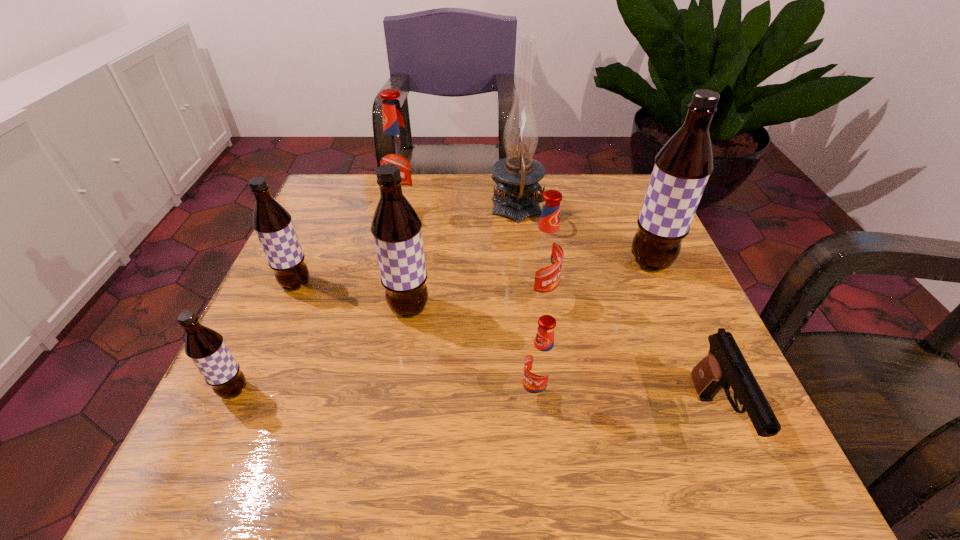
The height and width of the screenshot is (540, 960). Identify the location of the shortest object. (724, 366).

Where is `black pistol`? The width and height of the screenshot is (960, 540). black pistol is located at coordinates (724, 366).

Find the location of a particular element. This screenshot has width=960, height=540. vacant space situated 0.240m on the front of the oil lamp is located at coordinates (527, 309).

Identify the location of free space located 0.360m on the front of the biggest brown root beer. (729, 446).

The height and width of the screenshot is (540, 960). Identify the location of vacant space positioned on the front of the biggest red root beer. (397, 255).

The width and height of the screenshot is (960, 540). I want to click on vacant region located 0.290m on the back of the third brown root beer from left to right, so click(x=424, y=210).

Locate an element on the screen. This screenshot has width=960, height=540. vacant space located on the back of the third biggest brown root beer is located at coordinates (343, 177).

Where is `vacant space located 0.250m on the front of the second smallest red root beer`? vacant space located 0.250m on the front of the second smallest red root beer is located at coordinates (558, 433).

Identify the location of vacant space located 0.170m on the back of the smallest brown root beer. This screenshot has width=960, height=540. (275, 303).

This screenshot has height=540, width=960. In order to click on vacant space located 0.310m on the back of the nearest red root beer in this screenshot , I will do `click(522, 260)`.